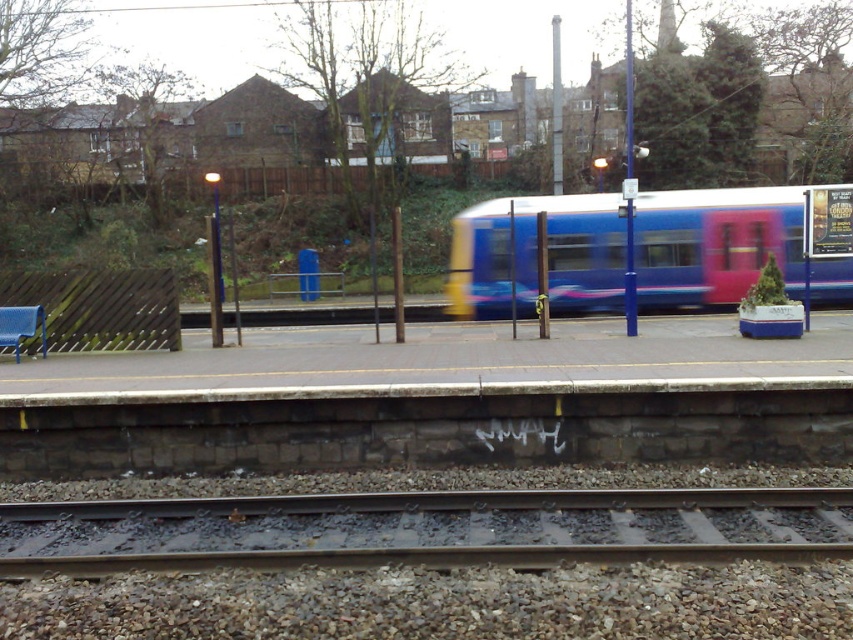
Who is positioned more to the right, metal at bottom or blue glossy train at center?

From the viewer's perspective, blue glossy train at center appears more on the right side.

In the scene shown: Who is higher up, metal at bottom or blue glossy train at center?

blue glossy train at center

Between point (280, 513) and point (624, 253), which one is positioned in front?

Point (280, 513) is more forward.

The width and height of the screenshot is (853, 640). In order to click on metal at bottom in this screenshot , I will do `click(424, 529)`.